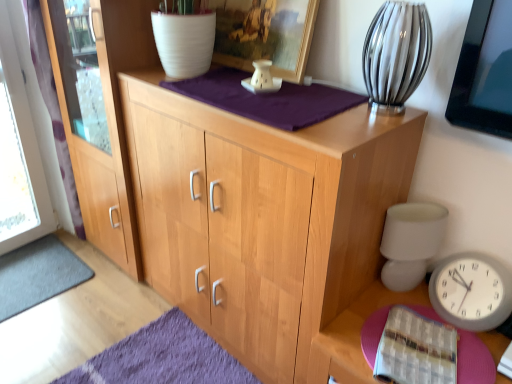
Question: Visually, is dark gray carpet at lower left positioned to the left or to the right of clear glass vase at upper right?

Choices:
 (A) right
 (B) left

Answer: (B)

Question: From a real-world perspective, is dark gray carpet at lower left above or below clear glass vase at upper right?

Choices:
 (A) below
 (B) above

Answer: (A)

Question: Considering the real-world distances, which object is closest to the clear glass vase at upper right?

Choices:
 (A) matte wood screen door at left
 (B) pink felt table at lower right
 (C) white matte table lamp at right
 (D) natural wood cabinet at center
 (E) white paper book at lower right

Answer: (C)

Question: Considering the real-world distances, which object is closest to the dark gray carpet at lower left?

Choices:
 (A) natural wood cabinet at center
 (B) white matte table lamp at right
 (C) wooden picture frame at upper center
 (D) pink felt table at lower right
 (E) white paper book at lower right

Answer: (A)